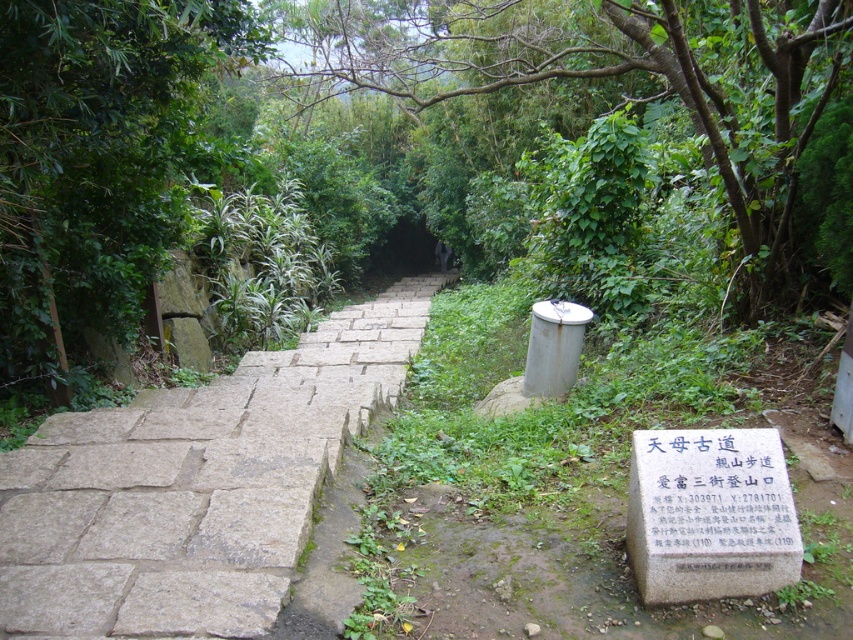
Question: Which point appears closest to the camera in this image?

Choices:
 (A) (788, 534)
 (B) (297, 67)

Answer: (A)

Question: Which is farther from the gray stone steps at center?

Choices:
 (A) white stone sign at lower right
 (B) green leafy tree at center

Answer: (B)

Question: Is green leafy tree at center wider than green leafy tree at left?

Choices:
 (A) no
 (B) yes

Answer: (B)

Question: Is gray stone steps at center closer to camera compared to white stone sign at lower right?

Choices:
 (A) yes
 (B) no

Answer: (A)

Question: Does green leafy tree at center appear under green leafy tree at left?

Choices:
 (A) no
 (B) yes

Answer: (A)

Question: Based on their relative distances, which object is nearer to the green leafy tree at center?

Choices:
 (A) green leafy tree at left
 (B) white stone sign at lower right

Answer: (B)